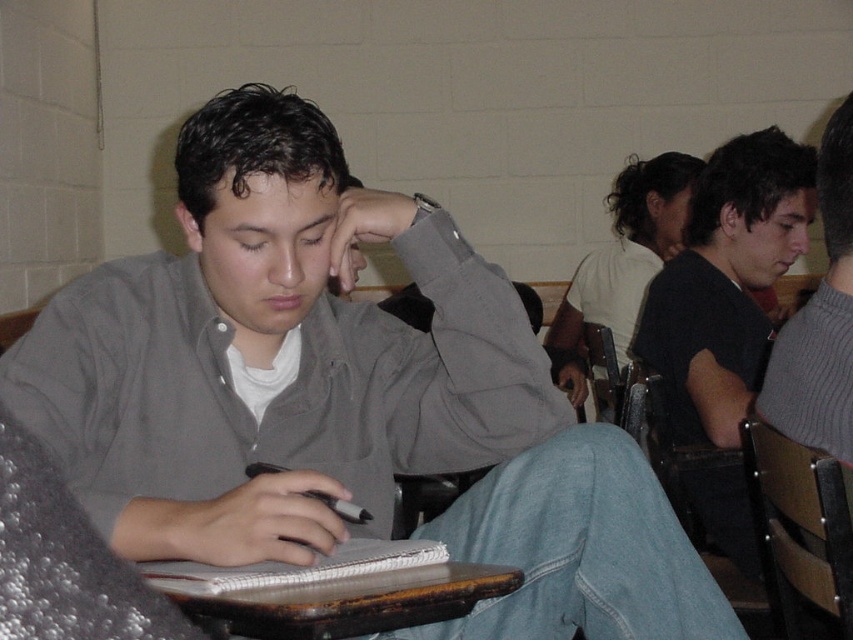
Who is more forward, (798, 147) or (218, 573)?

Point (218, 573) is in front.

Looking at this image, does matte gray hair at center have a smaller size compared to white paper notebook at center?

Actually, matte gray hair at center might be larger than white paper notebook at center.

Does point (717, 202) come closer to viewer compared to point (399, 541)?

No.

Find the location of a particular element. The image size is (853, 640). matte gray hair at center is located at coordinates (753, 205).

Is white matte shirt at upper right thinner than white paper notebook at center?

No, white matte shirt at upper right is not thinner than white paper notebook at center.

Which is more to the right, white matte shirt at upper right or white paper notebook at center?

Positioned to the right is white matte shirt at upper right.

Who is more forward, (646, 224) or (221, 580)?

Positioned in front is point (221, 580).

You are a GUI agent. You are given a task and a screenshot of the screen. Output one action in this format:
    pyautogui.click(x=<x>, y=<y>)
    Task: Click on the white matte shirt at upper right
    This screenshot has height=640, width=853.
    Given the screenshot: What is the action you would take?
    pyautogui.click(x=624, y=259)

Between point (183, 164) and point (569, 291), which one is positioned behind?

The point (569, 291) is behind.

Which of these two, matte gray shirt at center or white matte shirt at upper right, stands taller?

white matte shirt at upper right is taller.

Is point (321, 273) in front of point (605, 275)?

Yes, it is.

Image resolution: width=853 pixels, height=640 pixels. What are the coordinates of `matte gray shirt at center` in the screenshot? It's located at [260, 205].